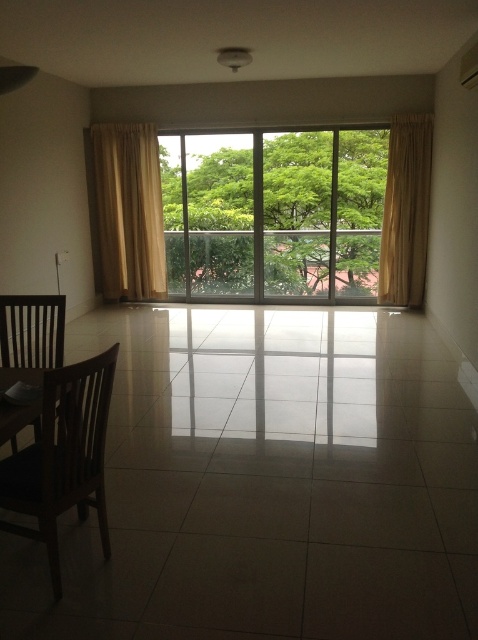
Does beige fabric curtain at right have a larger size compared to brown wooden chair at left?

Indeed, beige fabric curtain at right has a larger size compared to brown wooden chair at left.

Which of these two, beige fabric curtain at right or brown wooden chair at left, stands taller?

With more height is beige fabric curtain at right.

Is point (423, 131) behind point (45, 300)?

That is True.

Where is `beige fabric curtain at right`? This screenshot has height=640, width=478. beige fabric curtain at right is located at coordinates (405, 211).

Who is more forward, (x=32, y=454) or (x=1, y=346)?

Point (x=32, y=454) is more forward.

Can you confirm if brown wooden chair at lower left is thinner than brown wooden chair at left?

Indeed, brown wooden chair at lower left has a lesser width compared to brown wooden chair at left.

Between point (40, 435) and point (25, 321), which one is positioned behind?

The point (25, 321) is more distant.

The width and height of the screenshot is (478, 640). I want to click on brown wooden chair at lower left, so click(x=64, y=456).

Which of these two, clear glass window at center or brown wooden chair at lower left, stands shorter?

With less height is brown wooden chair at lower left.

Does clear glass window at center lie behind brown wooden chair at lower left?

Yes, it is.

The image size is (478, 640). Describe the element at coordinates (273, 212) in the screenshot. I see `clear glass window at center` at that location.

Where is `clear glass window at center`? clear glass window at center is located at coordinates (273, 212).